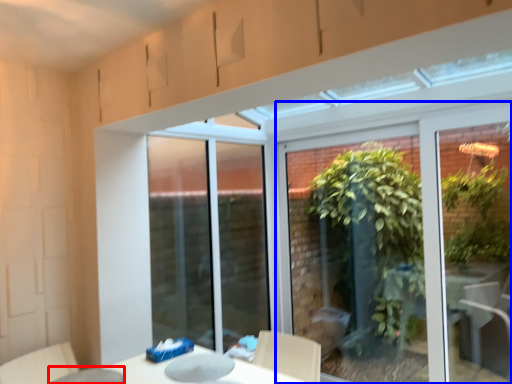
Question: Which object is closer to the camera taking this photo, glass table (highlighted by a red box) or window (highlighted by a blue box)?

Choices:
 (A) glass table
 (B) window

Answer: (A)